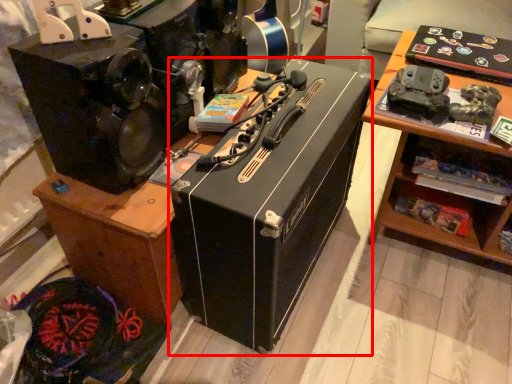
Question: Where is box (annotated by the red box) located in relation to furniture in the image?

Choices:
 (A) right
 (B) left

Answer: (A)